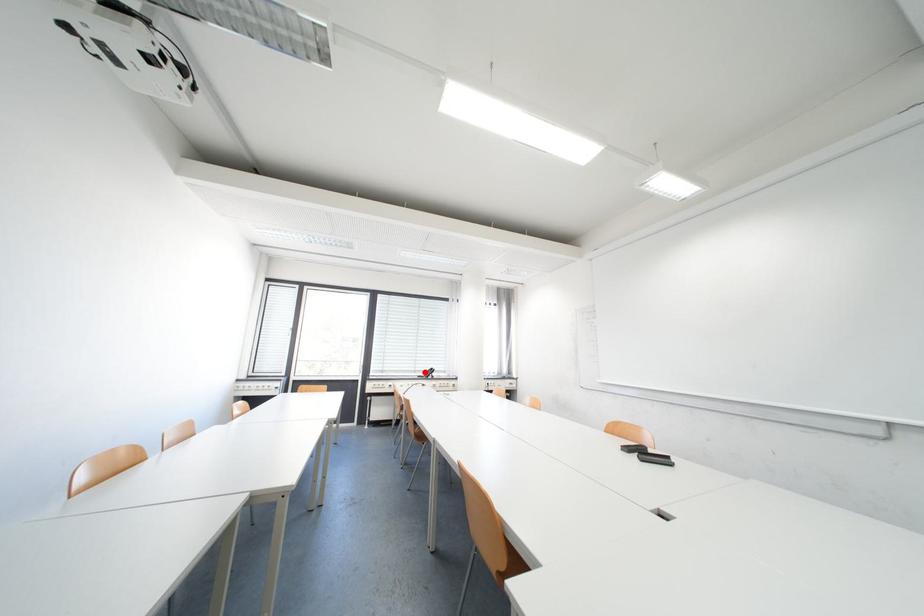
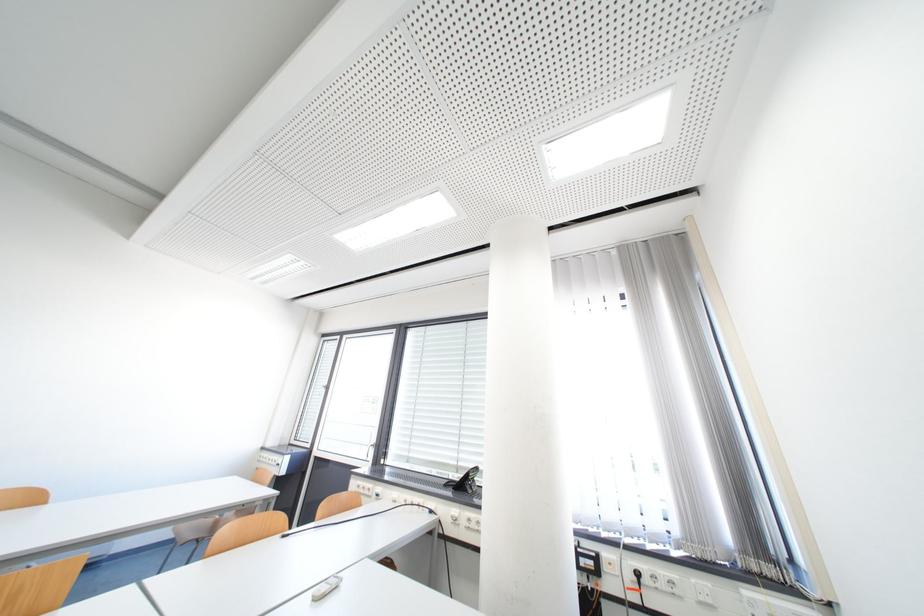
Find the pixel in the second image that matches the highlighted location in the first image.

(468, 469)